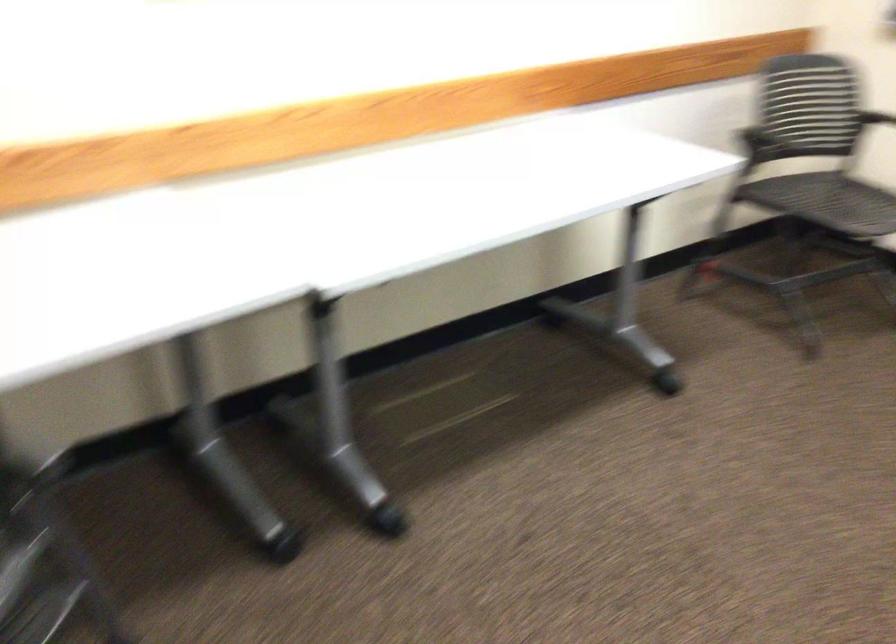
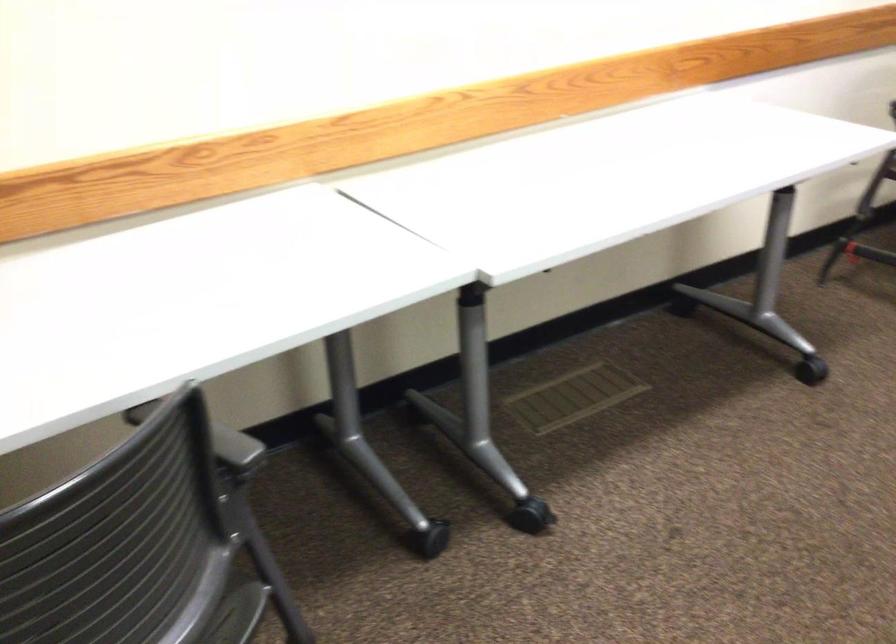
Question: Which direction would the cameraman need to move to produce the second image? Reply with the corresponding letter.

Choices:
 (A) Left
 (B) Right
 (C) Forward
 (D) Backward

Answer: (A)